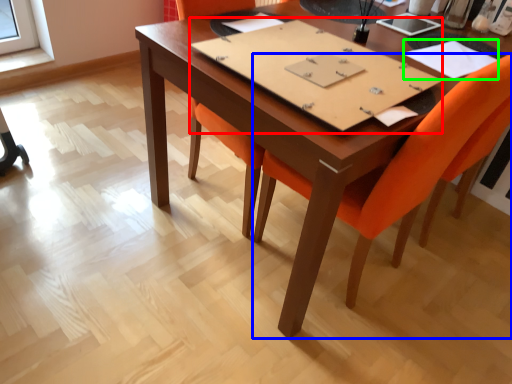
Question: Which object is positioned farthest from notebook (highlighted by a red box)? Select from chair (highlighted by a blue box) and notebook (highlighted by a green box).

Choices:
 (A) chair
 (B) notebook

Answer: (B)